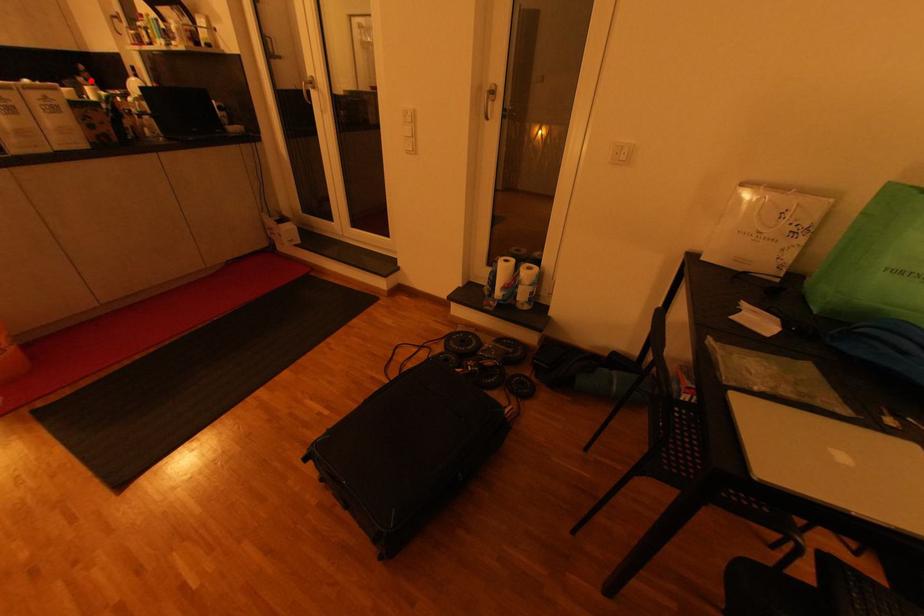
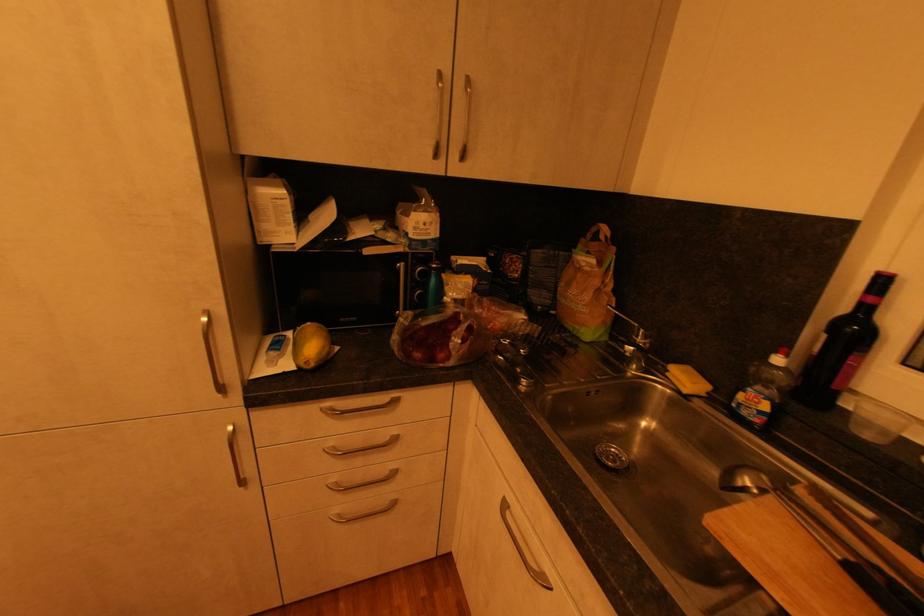
Question: I am providing you with two images of the same scene from different viewpoints. A red point is shown in image1. For the corresponding object point in image2, is it positioned nearer or farther from the camera?

Choices:
 (A) Nearer
 (B) Farther

Answer: (A)